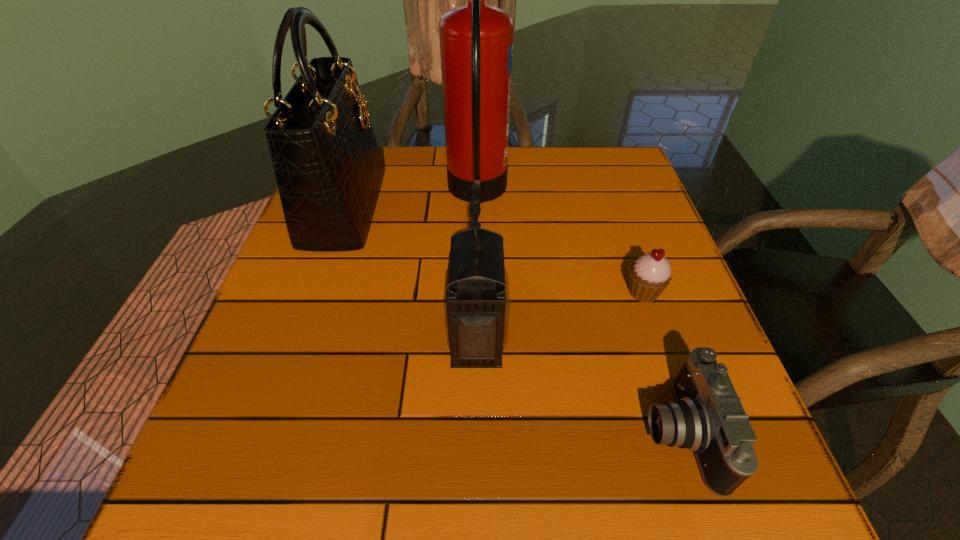
Identify the location of object positioned at the far left corner. (328, 167).

Where is `object located at the near right corner`? The image size is (960, 540). object located at the near right corner is located at coordinates (707, 417).

This screenshot has height=540, width=960. In the image, there is a desktop. Find the location of `vacant space at the near edge`. vacant space at the near edge is located at coordinates [350, 503].

Locate an element on the screen. vacant region at the left edge of the desktop is located at coordinates (341, 271).

I want to click on vacant space at the right edge of the desktop, so click(654, 240).

Identify the location of vacant space at the near left corner of the desktop. This screenshot has height=540, width=960. (195, 499).

Where is `vacant space at the far right corner of the desktop`? Image resolution: width=960 pixels, height=540 pixels. vacant space at the far right corner of the desktop is located at coordinates (611, 147).

Locate an element on the screen. Image resolution: width=960 pixels, height=540 pixels. free space that is in between the handbag and the fire extinguisher is located at coordinates (411, 200).

Find the location of a particular element. The height and width of the screenshot is (540, 960). vacant point located between the third shortest object and the camera is located at coordinates (578, 387).

Where is `vacant area that lies between the leftmost object and the third tallest object`? This screenshot has width=960, height=540. vacant area that lies between the leftmost object and the third tallest object is located at coordinates pos(411,274).